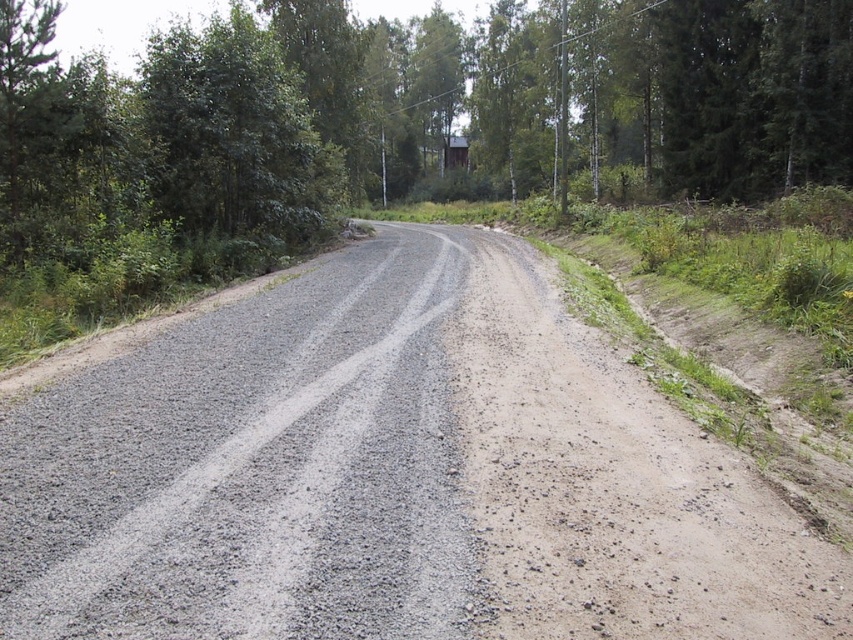
Question: Can you confirm if gray gravel road at center is positioned to the left of green leafy tree at center?

Choices:
 (A) no
 (B) yes

Answer: (B)

Question: Among these objects, which one is farthest from the camera?

Choices:
 (A) green leafy tree at center
 (B) green leafy tree at upper left
 (C) gray gravel road at center

Answer: (B)

Question: Estimate the real-world distances between objects in this image. Which object is closer to the green leafy tree at upper left?

Choices:
 (A) gray gravel road at center
 (B) green leafy tree at center

Answer: (A)

Question: Based on their relative distances, which object is farther from the gray gravel road at center?

Choices:
 (A) green leafy tree at center
 (B) green leafy tree at upper left

Answer: (A)

Question: Can you confirm if gray gravel road at center is positioned to the right of green leafy tree at center?

Choices:
 (A) yes
 (B) no

Answer: (B)

Question: From the image, what is the correct spatial relationship of green leafy tree at center in relation to green leafy tree at upper left?

Choices:
 (A) above
 (B) below

Answer: (B)